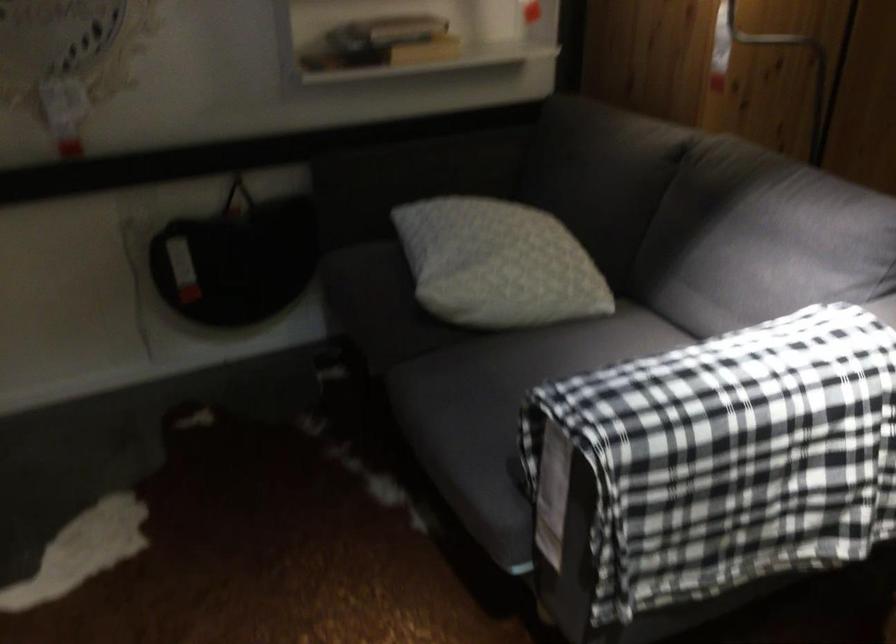
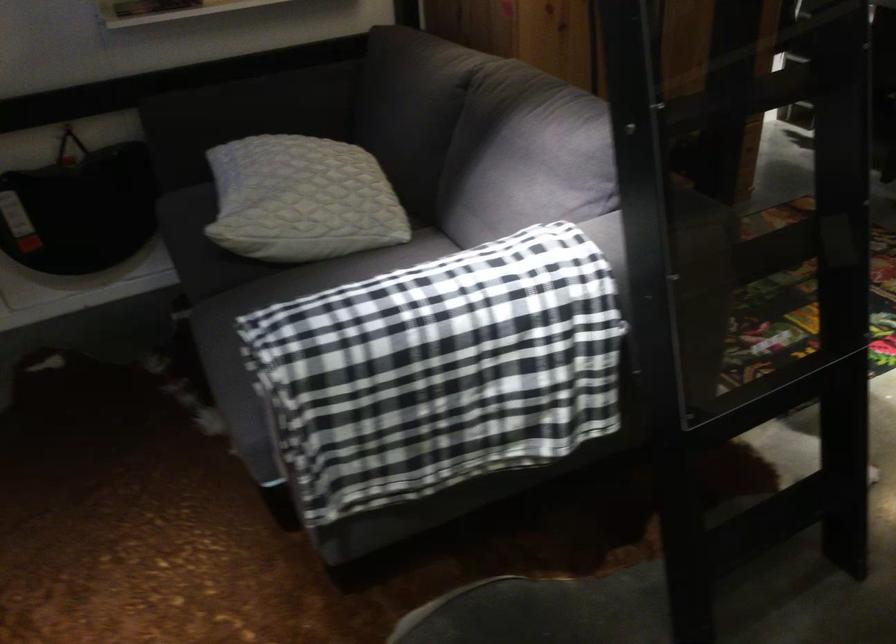
Question: Which direction would the cameraman need to move to produce the second image? Reply with the corresponding letter.

Choices:
 (A) Left
 (B) Right
 (C) Forward
 (D) Backward

Answer: (B)